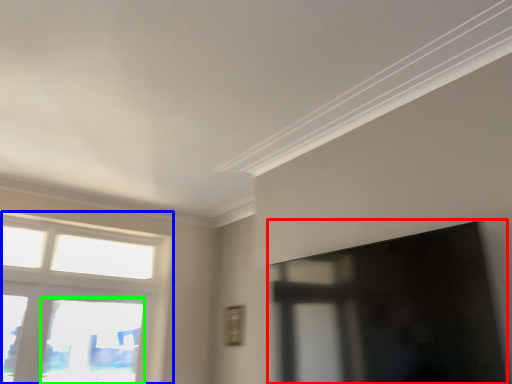
Question: Which object is positioned closest to window screen (highlighted by a red box)? Select from window (highlighted by a blue box) and window (highlighted by a green box).

Choices:
 (A) window
 (B) window

Answer: (B)